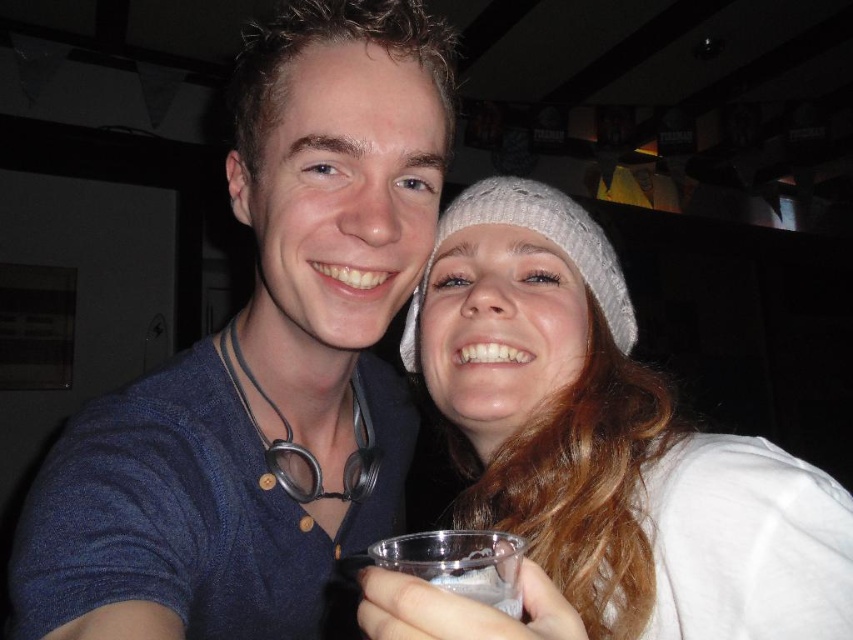
Question: Estimate the real-world distances between objects in this image. Which object is closer to the blue fabric shirt at center?

Choices:
 (A) clear plastic cup at lower center
 (B) white knitted hat at upper right
 (C) white knit hat at upper right

Answer: (C)

Question: Can you confirm if white knit hat at upper right is wider than clear plastic cup at lower center?

Choices:
 (A) no
 (B) yes

Answer: (B)

Question: Is the position of white knitted hat at upper right less distant than that of clear plastic cup at lower center?

Choices:
 (A) yes
 (B) no

Answer: (B)

Question: Which point is farther to the camera?

Choices:
 (A) white knitted hat at upper right
 (B) white knit hat at upper right
 (C) blue fabric shirt at center
 (D) clear plastic cup at lower center

Answer: (A)

Question: Is blue fabric shirt at center above clear plastic cup at lower center?

Choices:
 (A) yes
 (B) no

Answer: (A)

Question: Which of these objects is positioned farthest from the clear plastic cup at lower center?

Choices:
 (A) blue fabric shirt at center
 (B) white knitted hat at upper right
 (C) white knit hat at upper right

Answer: (B)